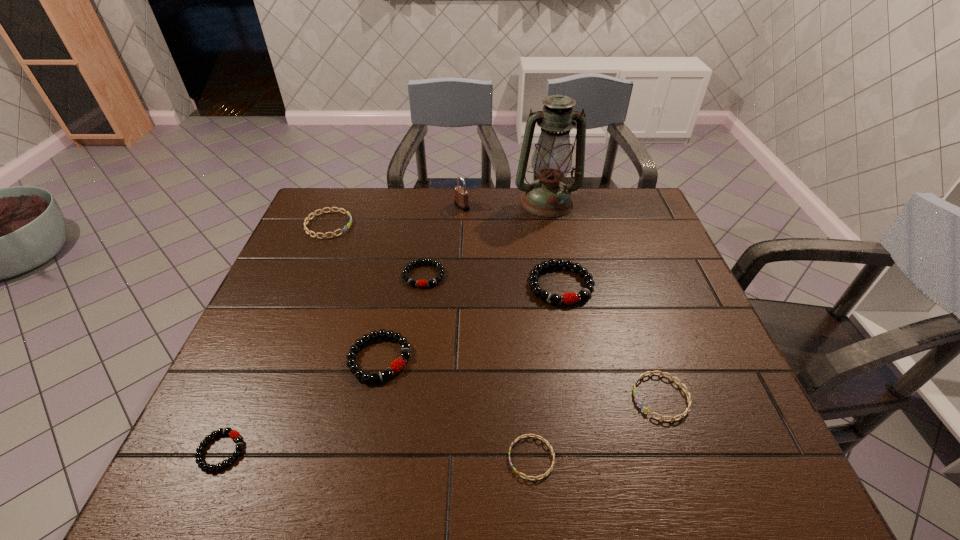
You are a GUI agent. You are given a task and a screenshot of the screen. Output one action in this format:
    pyautogui.click(x=<x>, y=<y>)
    Task: Click on the bracelet located at the far edge
    
    Given the screenshot: What is the action you would take?
    pyautogui.click(x=345, y=228)

Find the location of a particular element. The height and width of the screenshot is (540, 960). object at the right edge is located at coordinates (646, 410).

Identify the location of object at the far left corner. coord(345,228).

Find the location of a particular element. The image size is (960, 540). object situated at the near left corner is located at coordinates (233, 434).

This screenshot has width=960, height=540. What are the coordinates of `free space at the far edge of the desktop` in the screenshot? It's located at tap(439, 221).

In the image, there is a desktop. Identify the location of vacant space at the near edge. This screenshot has height=540, width=960. 429,480.

Identify the location of free space at the left edge of the desktop. (222, 439).

Locate an element on the screen. Image resolution: width=960 pixels, height=540 pixels. vacant space at the right edge of the desktop is located at coordinates (669, 270).

Where is `free region at the near left corner`? free region at the near left corner is located at coordinates (180, 484).

At what (x,y) coordinates should I click in order to perform the action: click on vacant space at the far right corner. Please return your answer as a coordinate pair (x, y). Looking at the image, I should click on (624, 198).